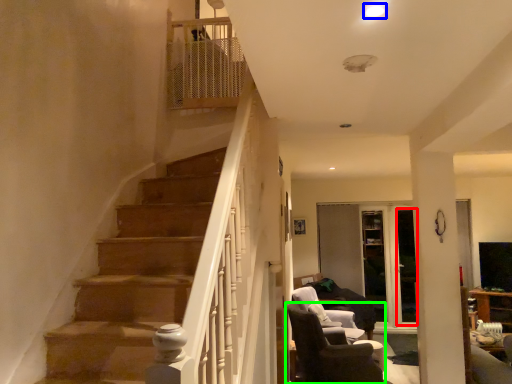
Question: Considering the real-world distances, which object is farthest from glass door (highlighted by a red box)? light (highlighted by a blue box) or chair (highlighted by a green box)?

Choices:
 (A) light
 (B) chair

Answer: (A)